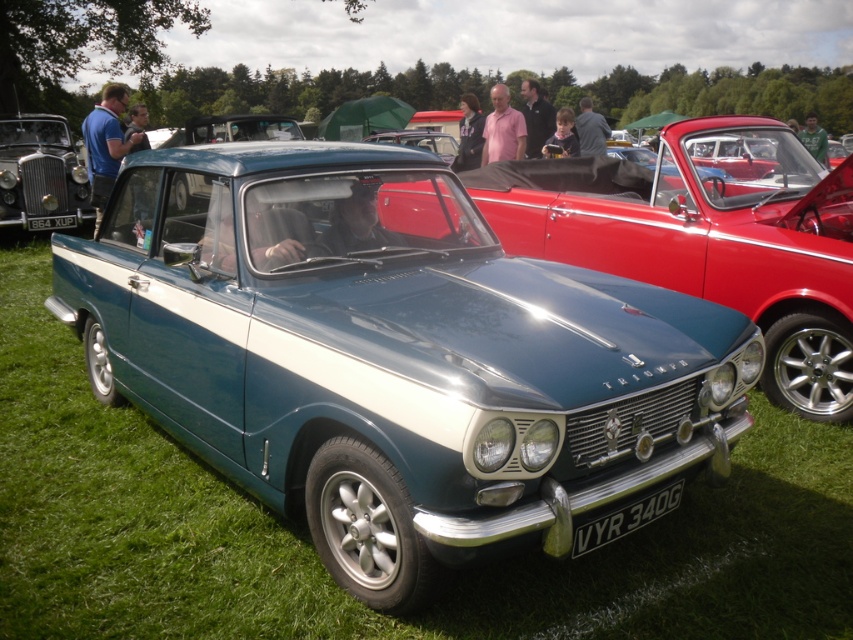
Is point (636, 524) in front of point (434, 150)?

Yes, it is.

Between black metal license plate at lower center and teal metallic car at center, which one is positioned lower?

black metal license plate at lower center

Who is more forward, [572,536] or [376,132]?

Point [572,536] is more forward.

Where is `black metal license plate at lower center`? black metal license plate at lower center is located at coordinates (625, 518).

From the picture: Can you confirm if metallic teal car at center is wider than metallic blue car at center?

Indeed, metallic teal car at center has a greater width compared to metallic blue car at center.

Which is behind, point (587, 481) or point (674, 134)?

The point (674, 134) is more distant.

Measure the distance between point (296,394) and camera.

The distance of point (296,394) from camera is 9.34 feet.

You are a GUI agent. You are given a task and a screenshot of the screen. Output one action in this format:
    pyautogui.click(x=<x>, y=<y>)
    Task: Click on the metallic teal car at center
    The image size is (853, 640).
    Given the screenshot: What is the action you would take?
    pyautogui.click(x=392, y=355)

Which is in front, point (531, 195) or point (413, 140)?

Positioned in front is point (531, 195).

From the picture: Is metallic blue car at center to the left of teal metallic car at center from the viewer's perspective?

In fact, metallic blue car at center is to the right of teal metallic car at center.

What are the coordinates of `metallic blue car at center` in the screenshot? It's located at (706, 237).